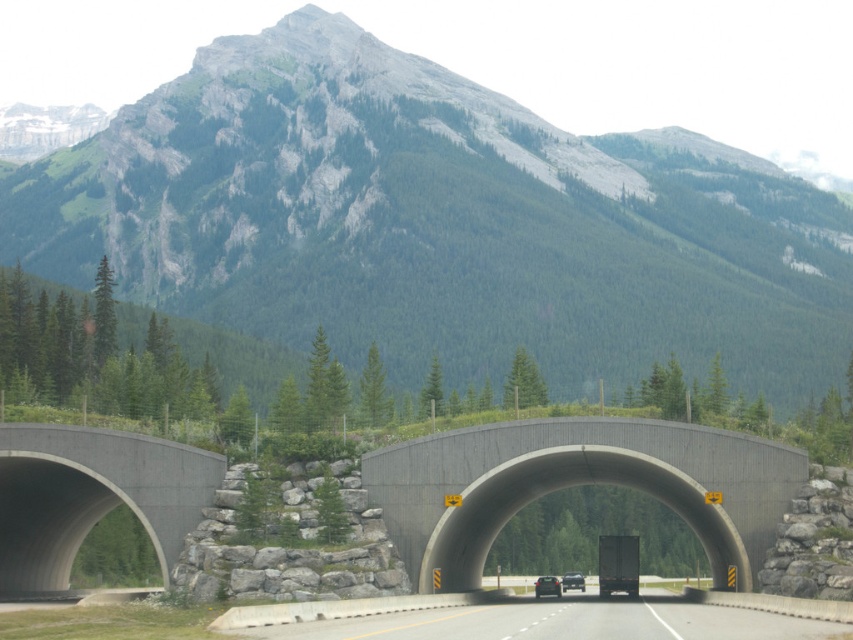
You are driving a matte black car at center and want to exit the gray concrete tunnel at left. Is the tunnel entrance ahead of you or behind you?

The gray concrete tunnel at left is closer to the viewer than the matte black car at center, so the tunnel entrance is ahead of you.

You are a surveyor trying to determine the distance between two points of interest in the image. The first point is labeled as point (108, 496). The second point is unlabeled but located 81.11 meters away from the first. Based on the scene description, can you identify the second point and its relation to the first?

The second point is 81.11 meters away from point (108, 496). Since the scene describes two concrete overpasses with rounded arches supported by large rock retaining walls, the second point is likely located on the other overpass, maintaining the structural distance between them.

You are a hiker planning to take a photo of the green rock mountain at upper center and the gray concrete tunnel at left. Which object should you focus on first if you want to capture both in a single frame without moving the camera?

You should focus on the green rock mountain at upper center first because it is larger in size compared to the gray concrete tunnel at left, allowing it to be the main subject while still fitting the smaller tunnel into the frame.